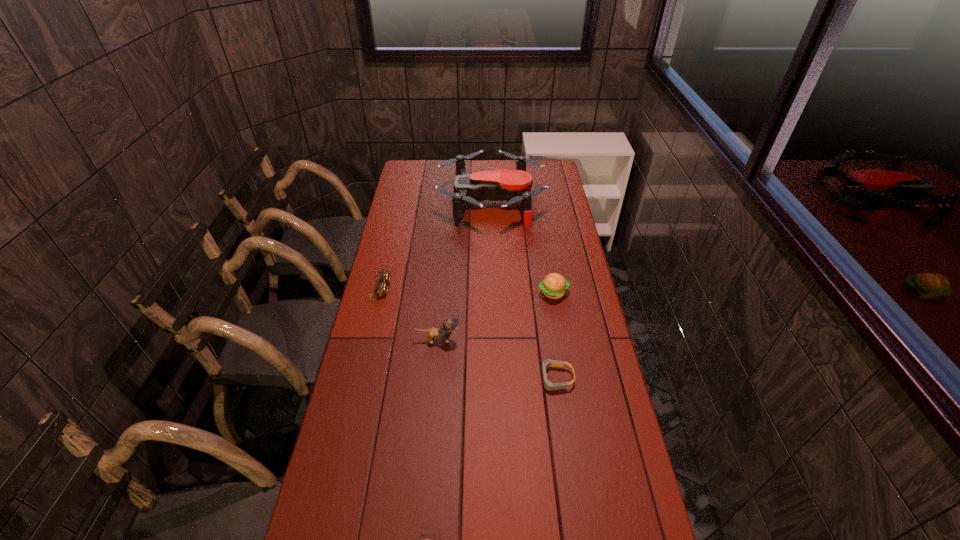
Find the location of a particular element. vacant region that satisfies the following two spatial constraints: 1. through the lenses of the tallest goggles; 2. on the back side of the hamburger is located at coordinates (380, 293).

You are a GUI agent. You are given a task and a screenshot of the screen. Output one action in this format:
    pyautogui.click(x=<x>, y=<y>)
    Task: Click on the free space that satisfies the following two spatial constraints: 1. on the camera side of the hamburger; 2. on the right side of the tallest object
    The image size is (960, 540).
    Given the screenshot: What is the action you would take?
    pyautogui.click(x=493, y=293)